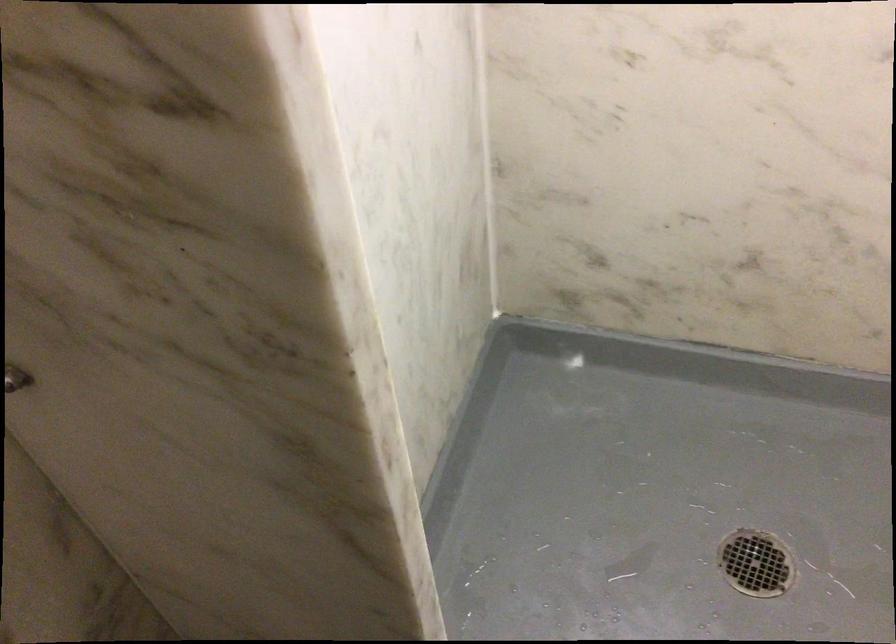
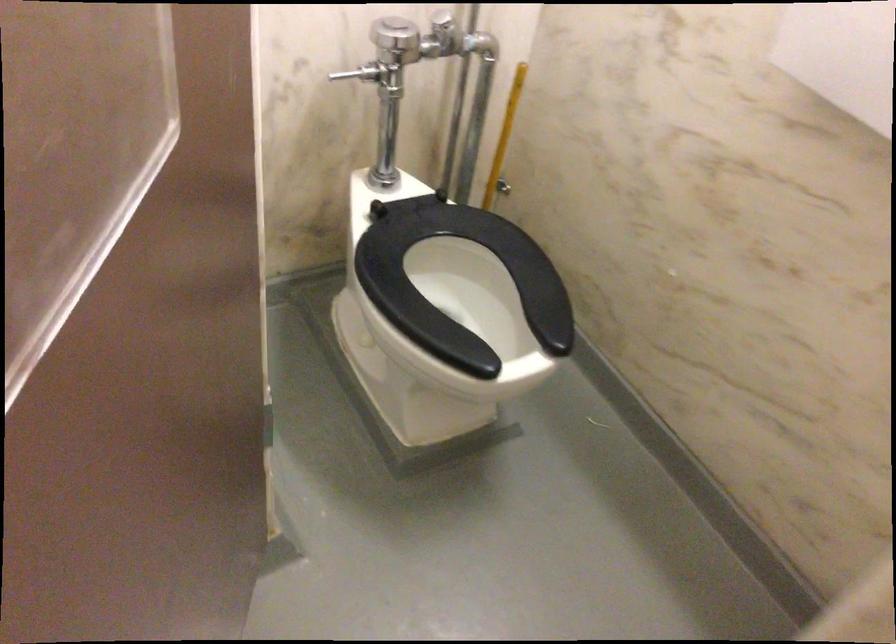
Question: Based on the continuous images, in which direction is the camera rotating? Reply with the corresponding letter.

Choices:
 (A) Left
 (B) Right
 (C) Up
 (D) Down

Answer: (B)